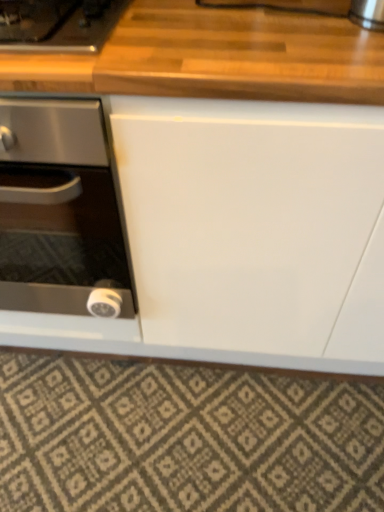
Question: Does black glass stove at left have a lesser width compared to wooden gas stove at upper left?

Choices:
 (A) no
 (B) yes

Answer: (A)

Question: Does black glass stove at left have a smaller size compared to wooden gas stove at upper left?

Choices:
 (A) yes
 (B) no

Answer: (B)

Question: Is black glass stove at left at the left side of wooden gas stove at upper left?

Choices:
 (A) yes
 (B) no

Answer: (A)

Question: Is the depth of black glass stove at left greater than that of wooden gas stove at upper left?

Choices:
 (A) yes
 (B) no

Answer: (B)

Question: Is wooden gas stove at upper left at the back of black glass stove at left?

Choices:
 (A) no
 (B) yes

Answer: (A)

Question: Looking at the image, does black glass stove at left seem bigger or smaller compared to wooden gas stove at upper left?

Choices:
 (A) big
 (B) small

Answer: (A)

Question: From the image's perspective, is black glass stove at left positioned above or below wooden gas stove at upper left?

Choices:
 (A) above
 (B) below

Answer: (B)

Question: Is point (29, 218) closer or farther from the camera than point (74, 28)?

Choices:
 (A) closer
 (B) farther

Answer: (B)

Question: Considering the positions of black glass stove at left and wooden gas stove at upper left in the image, is black glass stove at left taller or shorter than wooden gas stove at upper left?

Choices:
 (A) short
 (B) tall

Answer: (B)

Question: Is textured beige rug at lower center taller or shorter than black glass stove at left?

Choices:
 (A) tall
 (B) short

Answer: (B)

Question: In terms of size, does textured beige rug at lower center appear bigger or smaller than black glass stove at left?

Choices:
 (A) big
 (B) small

Answer: (B)

Question: Considering the positions of point (370, 406) and point (71, 161), is point (370, 406) closer or farther from the camera than point (71, 161)?

Choices:
 (A) closer
 (B) farther

Answer: (B)

Question: From a real-world perspective, is textured beige rug at lower center physically located above or below black glass stove at left?

Choices:
 (A) below
 (B) above

Answer: (A)

Question: From their relative heights in the image, would you say wooden gas stove at upper left is taller or shorter than textured beige rug at lower center?

Choices:
 (A) tall
 (B) short

Answer: (A)

Question: From the image's perspective, relative to textured beige rug at lower center, is wooden gas stove at upper left above or below?

Choices:
 (A) below
 (B) above

Answer: (B)